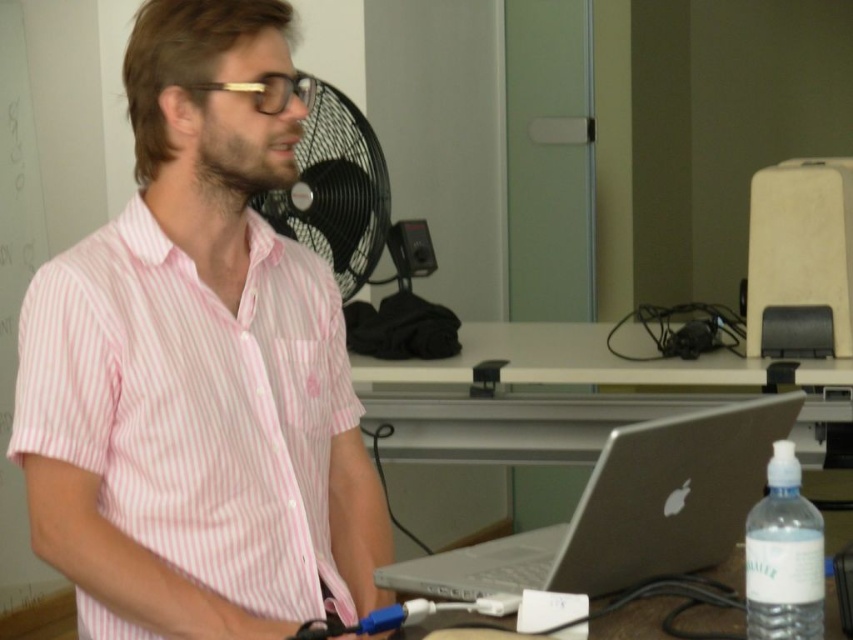
Question: Is pink striped shirt at center closer to the viewer compared to silver metallic laptop at center?

Choices:
 (A) no
 (B) yes

Answer: (A)

Question: Which of the following is the farthest from the observer?

Choices:
 (A) (79, 365)
 (B) (372, 141)

Answer: (B)

Question: Which is nearer to the silver metallic laptop at center?

Choices:
 (A) clear plastic bottle at lower right
 (B) black plastic fan at center
 (C) pink striped shirt at center

Answer: (A)

Question: Which object appears closest to the camera in this image?

Choices:
 (A) pink striped shirt at center
 (B) black plastic fan at center

Answer: (A)

Question: Considering the relative positions of pink striped shirt at center and silver metallic laptop at center in the image provided, where is pink striped shirt at center located with respect to silver metallic laptop at center?

Choices:
 (A) left
 (B) right

Answer: (A)

Question: Observing the image, what is the correct spatial positioning of black plastic fan at center in reference to clear plastic bottle at lower right?

Choices:
 (A) right
 (B) left

Answer: (B)